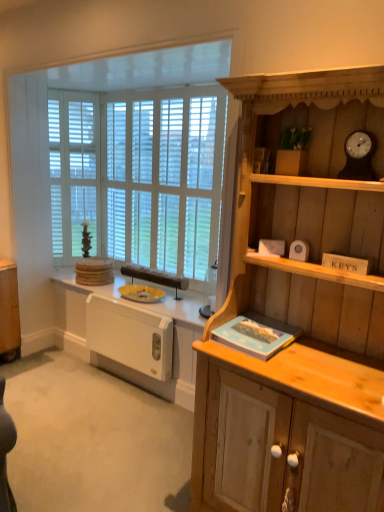
Locate an element on the screen. The height and width of the screenshot is (512, 384). free point below white wooden window at upper left (from a real-world perspective) is located at coordinates coord(100,401).